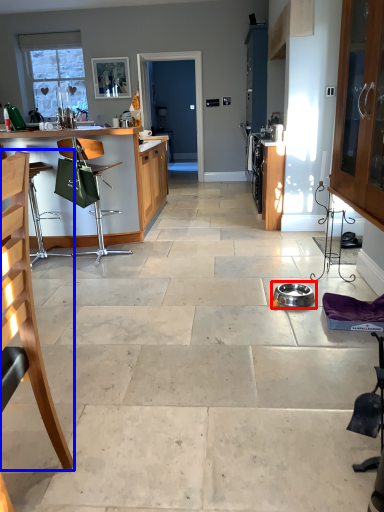
Question: Which of the following is the closest to the observer, appliance (highlighted by a red box) or chair (highlighted by a blue box)?

Choices:
 (A) appliance
 (B) chair

Answer: (B)